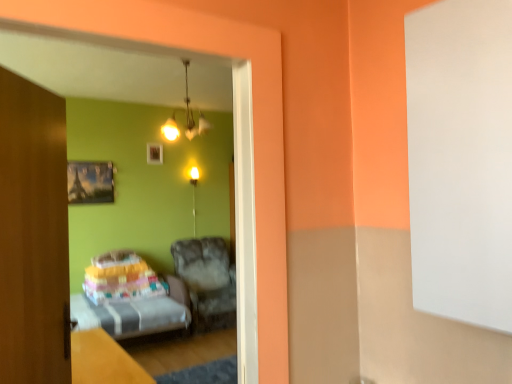
Question: Can we say metallic silver picture frame at upper left, which is counted as the first picture frame, starting from the front, lies outside wooden table at lower left?

Choices:
 (A) no
 (B) yes

Answer: (B)

Question: Does metallic silver picture frame at upper left, the 1th picture frame positioned from the left, appear on the left side of wooden table at lower left?

Choices:
 (A) no
 (B) yes

Answer: (B)

Question: Can you confirm if metallic silver picture frame at upper left, placed as the second picture frame when sorted from right to left, is smaller than wooden table at lower left?

Choices:
 (A) no
 (B) yes

Answer: (B)

Question: Is metallic silver picture frame at upper left, the 1th picture frame positioned from the left, positioned with its back to wooden table at lower left?

Choices:
 (A) yes
 (B) no

Answer: (B)

Question: From a real-world perspective, is metallic silver picture frame at upper left, the 1th picture frame positioned from the left, under wooden table at lower left?

Choices:
 (A) no
 (B) yes

Answer: (A)

Question: From the image's perspective, relative to matte white chandelier at upper center, is wooden door at left above or below?

Choices:
 (A) above
 (B) below

Answer: (B)

Question: Is wooden door at left to the left or to the right of matte white chandelier at upper center in the image?

Choices:
 (A) right
 (B) left

Answer: (B)

Question: Is wooden door at left bigger or smaller than matte white chandelier at upper center?

Choices:
 (A) big
 (B) small

Answer: (B)

Question: From their relative heights in the image, would you say wooden door at left is taller or shorter than matte white chandelier at upper center?

Choices:
 (A) tall
 (B) short

Answer: (A)

Question: From the image's perspective, relative to matte gold light fixture at center, is matte white chandelier at upper center above or below?

Choices:
 (A) above
 (B) below

Answer: (A)

Question: Relative to matte gold light fixture at center, is matte white chandelier at upper center in front or behind?

Choices:
 (A) behind
 (B) front

Answer: (B)

Question: Is matte white chandelier at upper center taller or shorter than matte gold light fixture at center?

Choices:
 (A) tall
 (B) short

Answer: (B)

Question: From a real-world perspective, is matte white chandelier at upper center physically located above or below matte gold light fixture at center?

Choices:
 (A) above
 (B) below

Answer: (A)

Question: Which is correct: transparent glass door at left is inside metallic silver picture frame at upper left, placed as the second picture frame when sorted from right to left, or outside of it?

Choices:
 (A) inside
 (B) outside

Answer: (B)

Question: Is transparent glass door at left to the left or to the right of metallic silver picture frame at upper left, the second picture frame positioned from the top, in the image?

Choices:
 (A) left
 (B) right

Answer: (B)